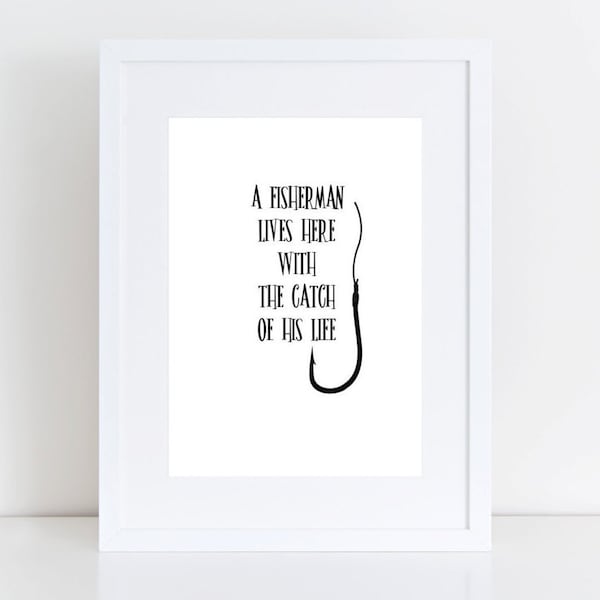
Find the location of a particular element. Image resolution: width=600 pixels, height=600 pixels. bottom of mounting board is located at coordinates (292, 453).